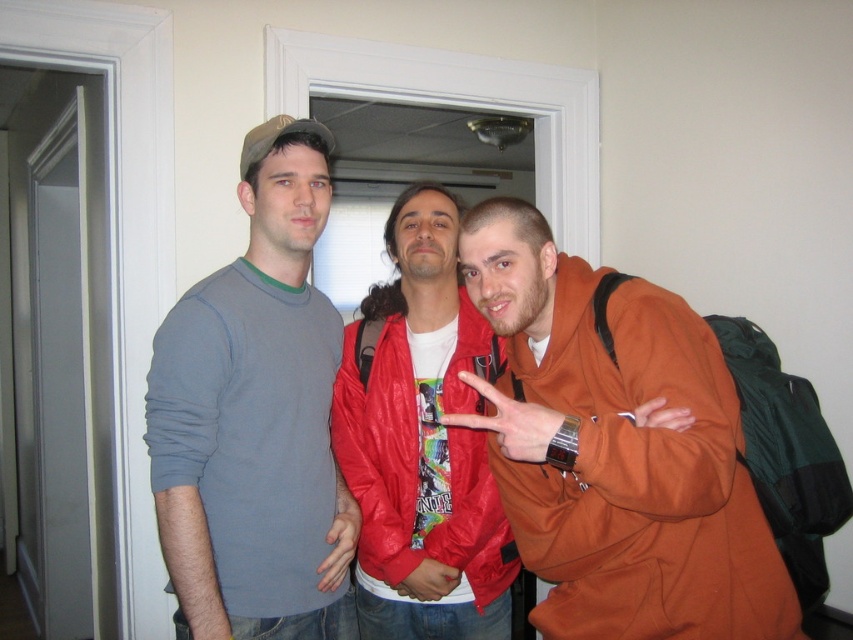
Is point (210, 339) behind point (431, 474)?

That is False.

Is point (254, 404) less distant than point (490, 589)?

Yes, point (254, 404) is in front of point (490, 589).

Is point (294, 444) positioned before point (498, 589)?

That is True.

Where is `matte gray t-shirt at center`? Image resolution: width=853 pixels, height=640 pixels. matte gray t-shirt at center is located at coordinates (254, 419).

Is orange fleece jacket at right positioned before shiny red jacket at center?

Yes.

Between orange fleece jacket at right and shiny red jacket at center, which one has more height?

With more height is shiny red jacket at center.

Where is `orange fleece jacket at right`? The width and height of the screenshot is (853, 640). orange fleece jacket at right is located at coordinates (640, 480).

The image size is (853, 640). What are the coordinates of `orange fleece jacket at right` in the screenshot? It's located at (640, 480).

Is matte gray t-shirt at center above orange fleece jacket at right?

Correct, matte gray t-shirt at center is located above orange fleece jacket at right.

In the scene shown: Can you confirm if matte gray t-shirt at center is shorter than orange fleece jacket at right?

No.

What do you see at coordinates (254, 419) in the screenshot? The width and height of the screenshot is (853, 640). I see `matte gray t-shirt at center` at bounding box center [254, 419].

What are the coordinates of `matte gray t-shirt at center` in the screenshot? It's located at (254, 419).